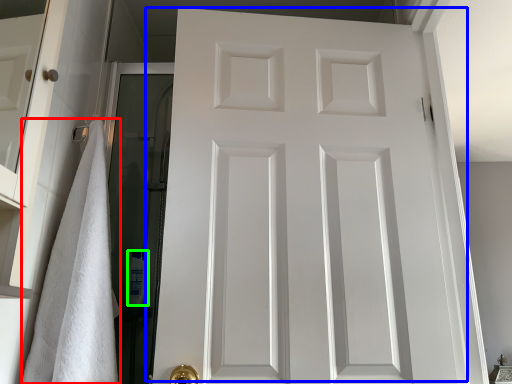
Question: Which is nearer to the bath towel (highlighted by a red box)? door (highlighted by a blue box) or toiletry (highlighted by a green box).

Choices:
 (A) door
 (B) toiletry

Answer: (A)